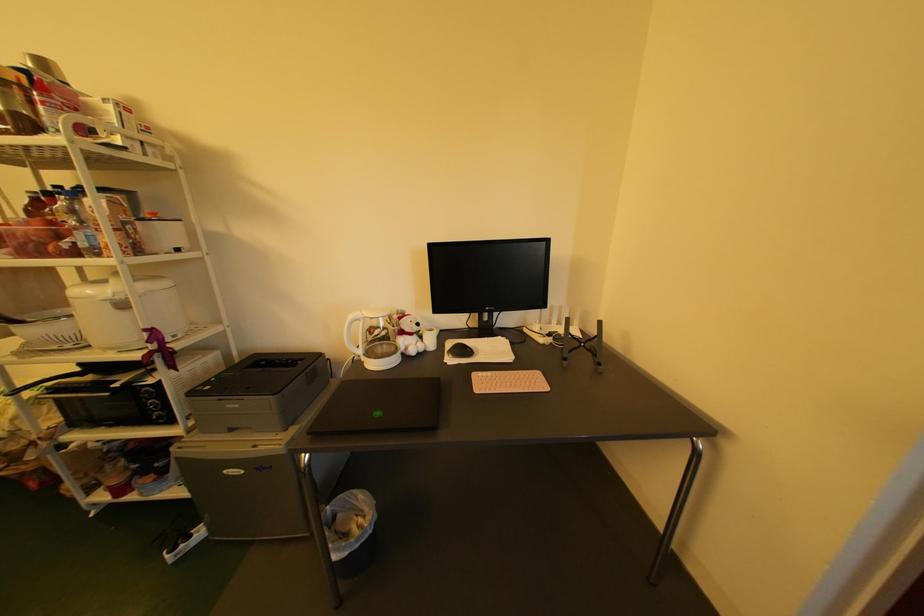
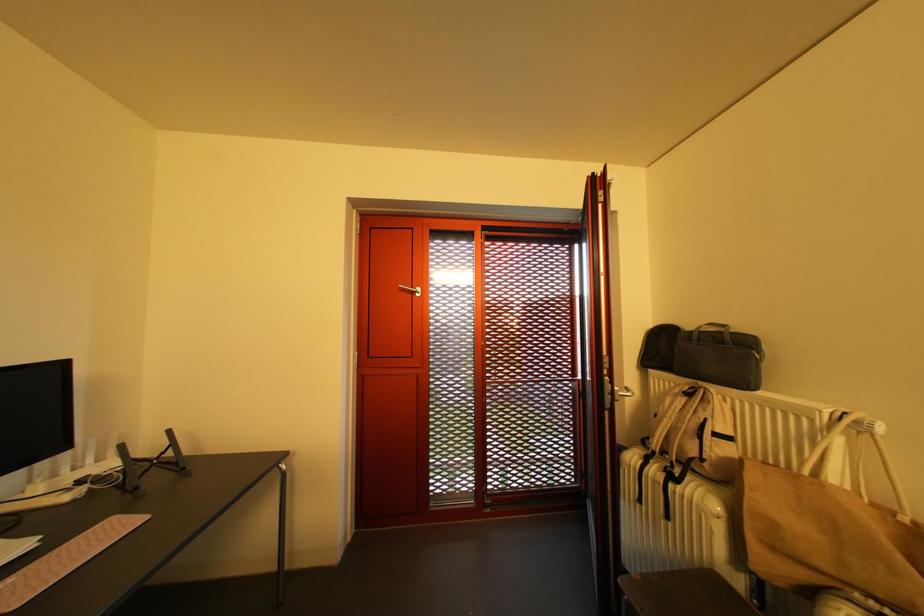
Question: Based on the continuous images, in which direction is the camera rotating? Reply with the corresponding letter.

Choices:
 (A) Left
 (B) Right
 (C) Up
 (D) Down

Answer: (B)